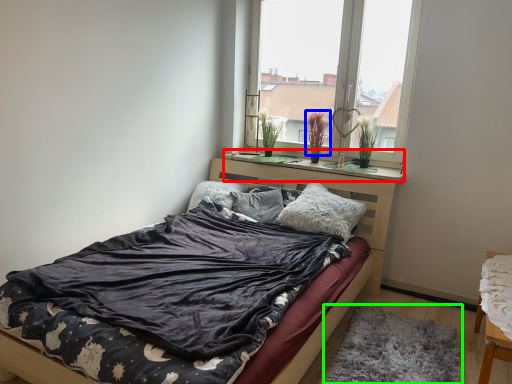
Question: Which object is the closest to the window sill (highlighted by a red box)? Choose among these: plant (highlighted by a blue box) or mat (highlighted by a green box).

Choices:
 (A) plant
 (B) mat

Answer: (A)